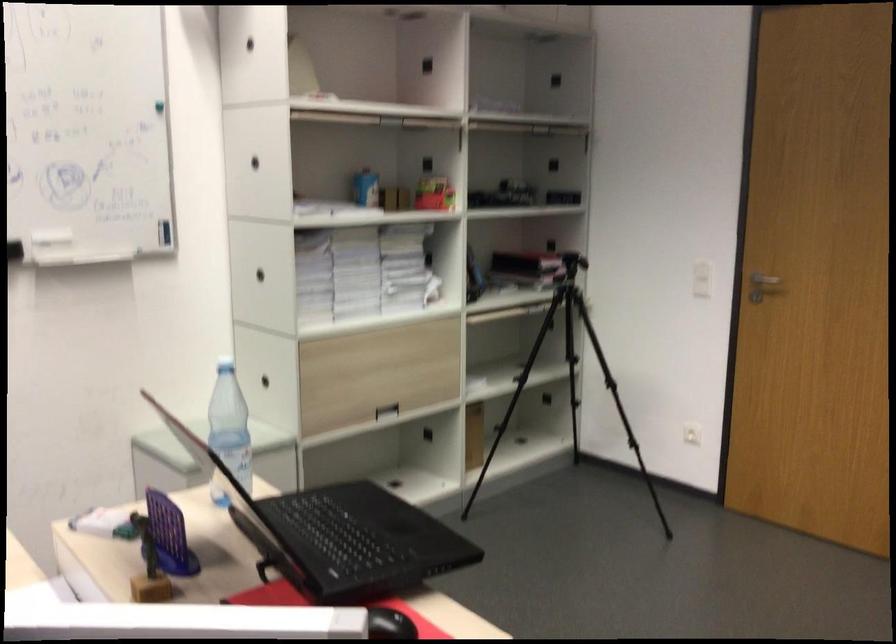
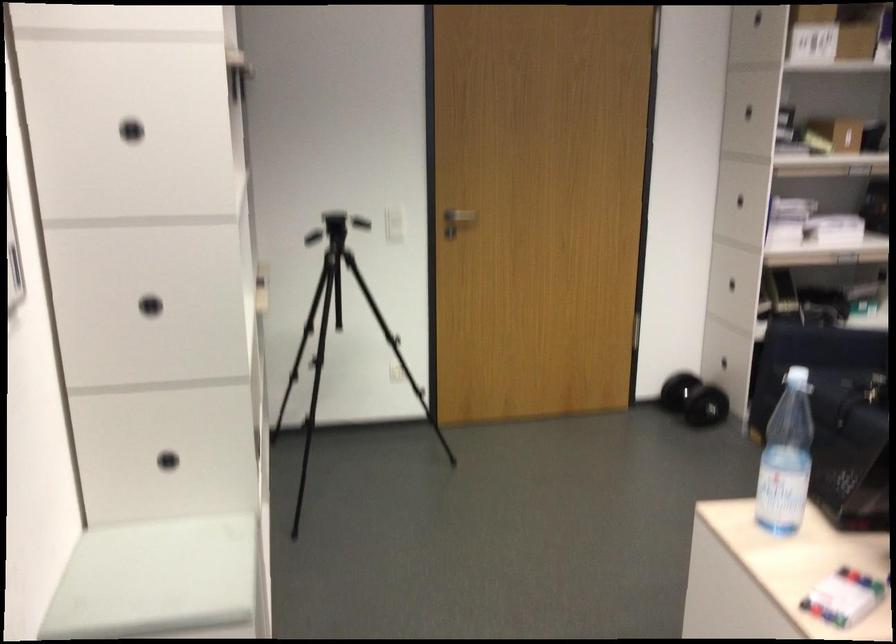
The point at (739, 270) is marked in the first image. Where is the corresponding point in the second image?

(393, 214)